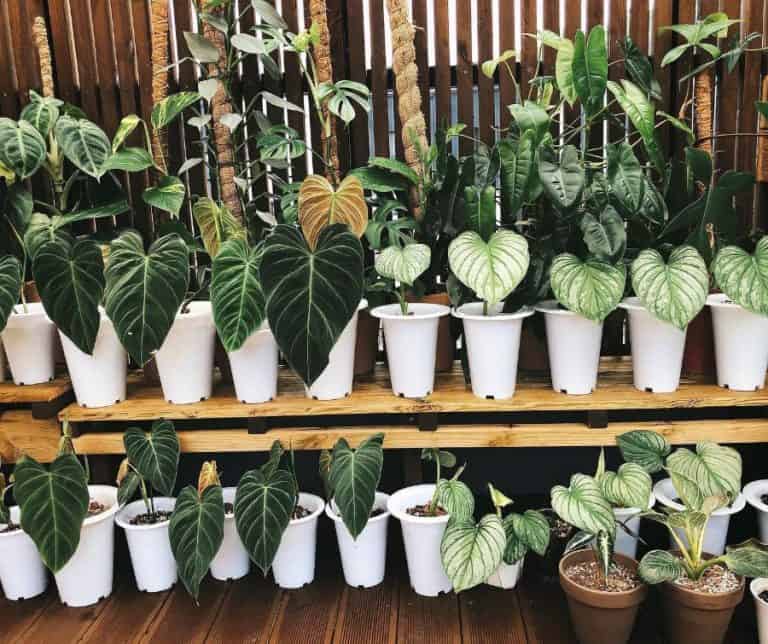
The image size is (768, 644). I want to click on pot, so click(415, 372).